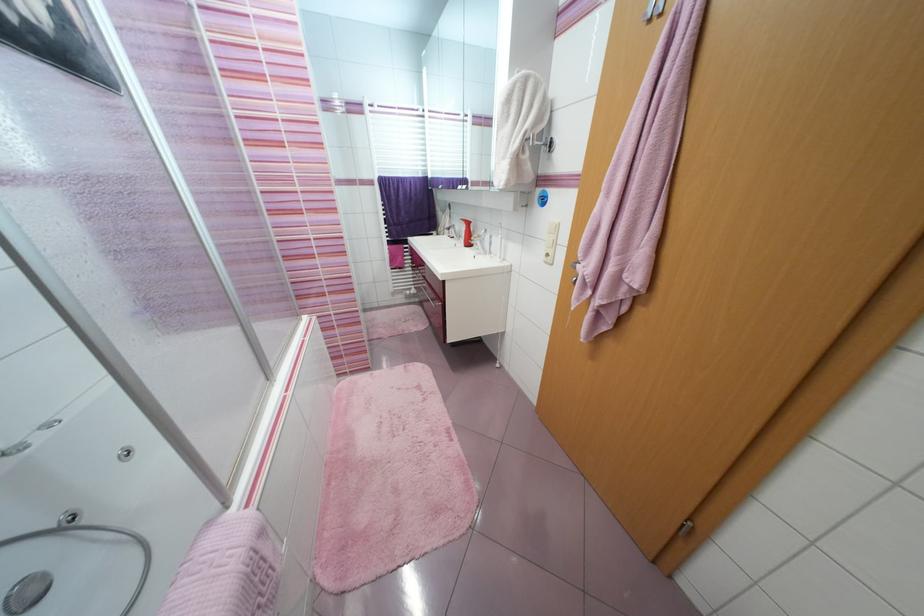
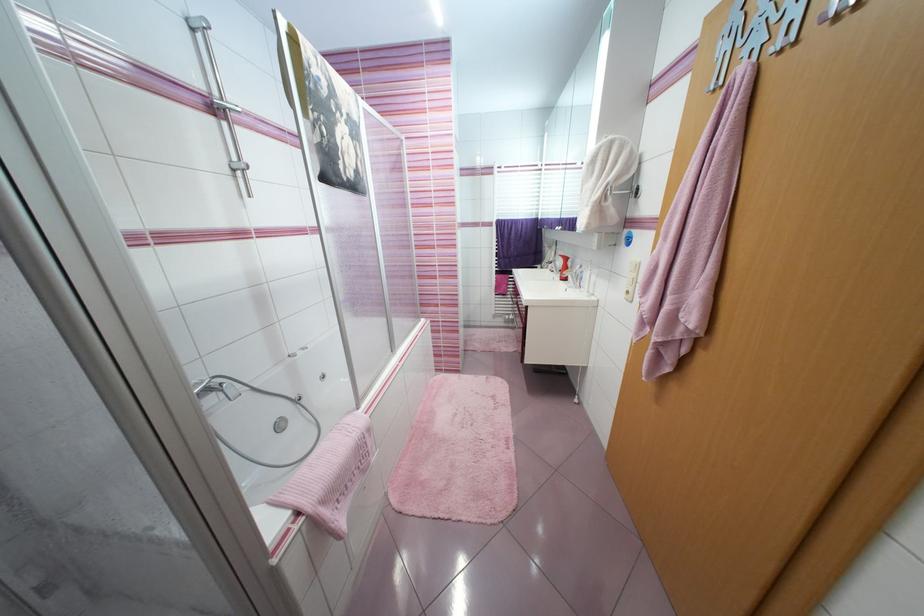
The point at (462, 229) is marked in the first image. Where is the corresponding point in the second image?

(563, 264)